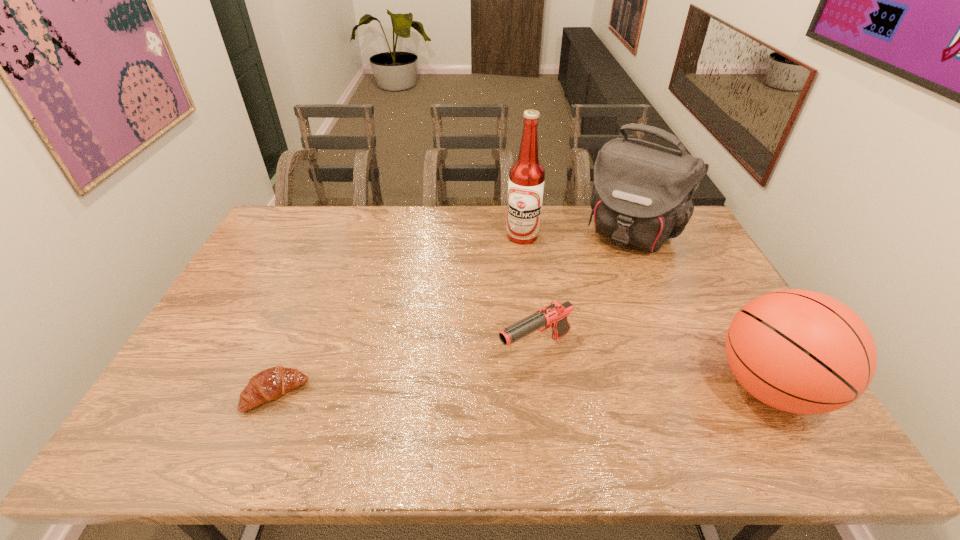
What are the coordinates of `basketball located at the near edge` in the screenshot? It's located at (799, 351).

The width and height of the screenshot is (960, 540). I want to click on basketball that is at the right edge, so click(x=799, y=351).

In order to click on shoulder bag present at the right edge in this screenshot , I will do `click(642, 194)`.

The image size is (960, 540). Find the location of `object situated at the far right corner`. object situated at the far right corner is located at coordinates (642, 194).

This screenshot has width=960, height=540. Identify the location of object that is positioned at the near right corner. (799, 351).

I want to click on vacant position at the far edge of the desktop, so click(561, 232).

In the image, there is a desktop. Where is `vacant space at the near edge`? Image resolution: width=960 pixels, height=540 pixels. vacant space at the near edge is located at coordinates (342, 410).

The height and width of the screenshot is (540, 960). In order to click on free space at the left edge in this screenshot , I will do `click(256, 268)`.

Find the location of `blank area at the right edge`. blank area at the right edge is located at coordinates (695, 265).

The width and height of the screenshot is (960, 540). Find the location of `vacant space at the far right corner of the desktop`. vacant space at the far right corner of the desktop is located at coordinates (688, 242).